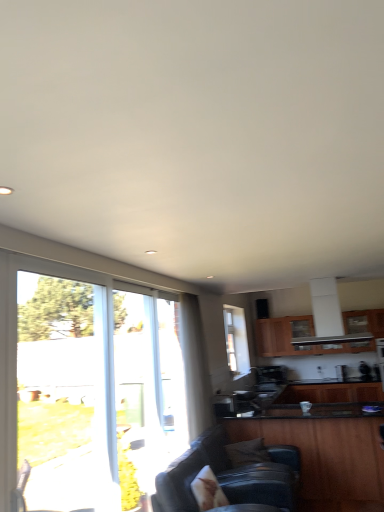
Question: From a real-world perspective, is wooden cabinet at lower right, marked as the 1th cabinetry in a front-to-back arrangement, positioned above or below wooden cabinet at upper center, which is the third cabinetry from front to back?

Choices:
 (A) below
 (B) above

Answer: (A)

Question: From the image's perspective, is wooden cabinet at lower right, which ranks as the third cabinetry in back-to-front order, above or below wooden cabinet at upper center, the first cabinetry viewed from the back?

Choices:
 (A) above
 (B) below

Answer: (B)

Question: Estimate the real-world distances between objects in this image. Which object is farther from the wooden cabinet at upper center, the first cabinetry viewed from the back?

Choices:
 (A) wooden cabinet at lower right, which is the second cabinetry in front-to-back order
 (B) clear glass window at center, arranged as the 2th window when viewed from the left
 (C) leather couch at lower center
 (D) clear glass window at left, placed as the 2th window when sorted from right to left
 (E) wooden cabinet at lower right, marked as the 1th cabinetry in a front-to-back arrangement

Answer: (D)

Question: Which is nearer to the wooden cabinet at lower right, which ranks as the third cabinetry in back-to-front order?

Choices:
 (A) clear glass window at center, arranged as the 2th window when viewed from the left
 (B) wooden cabinet at lower right, which is the second cabinetry in front-to-back order
 (C) clear glass window at left, the first window viewed from the left
 (D) wooden cabinet at upper center, which is the third cabinetry from front to back
 (E) leather couch at lower center

Answer: (E)